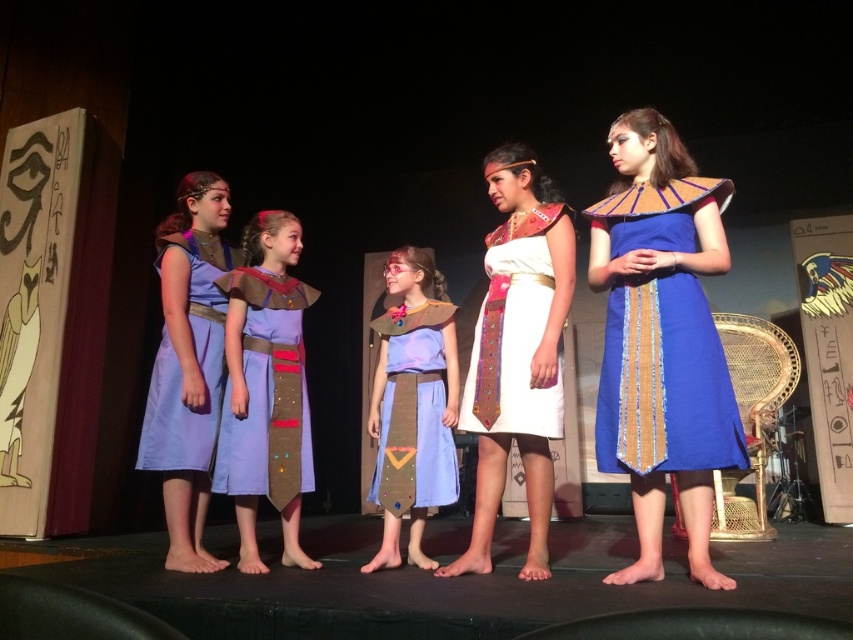
Does white cotton dress at center appear on the left side of light blue fabric dress at center?

In fact, white cotton dress at center is to the right of light blue fabric dress at center.

Who is more distant from viewer, (555, 355) or (386, 432)?

The point (386, 432) is behind.

Between point (482, 529) and point (386, 333), which one is positioned in front?

Point (482, 529) is in front.

Image resolution: width=853 pixels, height=640 pixels. Find the location of `white cotton dress at center`. white cotton dress at center is located at coordinates coord(518,352).

From the picture: Is white cotton dress at center to the right of matte blue fabric dress at center from the viewer's perspective?

Correct, you'll find white cotton dress at center to the right of matte blue fabric dress at center.

Is point (541, 451) positioned after point (270, 323)?

No, it is in front of (270, 323).

Measure the distance between white cotton dress at center and camera.

white cotton dress at center is 2.57 meters away from camera.

This screenshot has width=853, height=640. What are the coordinates of `white cotton dress at center` in the screenshot? It's located at (518, 352).

Which is behind, point (550, 417) or point (485, 260)?

The point (485, 260) is behind.

Is white cotton dress at center shorter than white satin dress at center?

No.

Find the location of a particular element. white cotton dress at center is located at coordinates (518, 352).